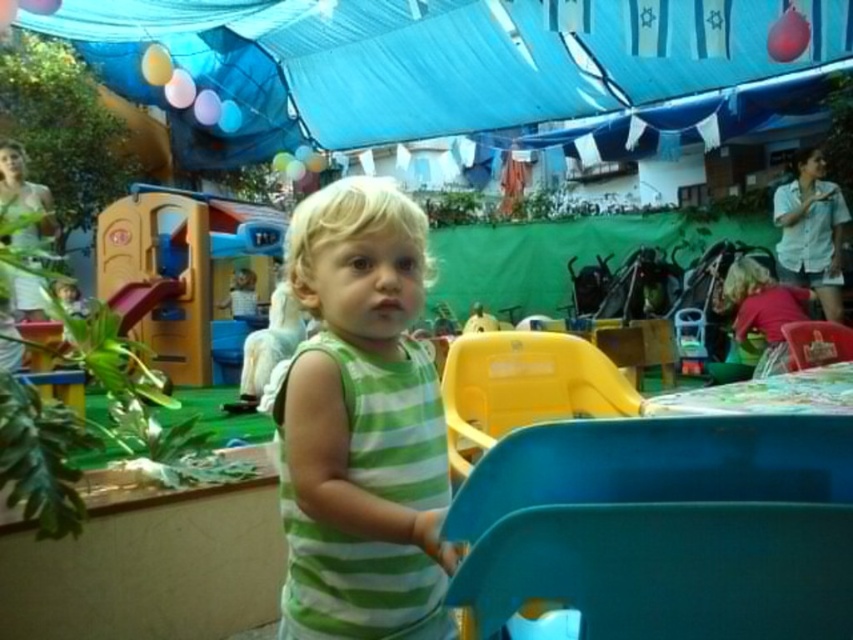
Question: From the image, what is the correct spatial relationship of blue fabric canopy at upper center in relation to green striped tank top at center?

Choices:
 (A) right
 (B) left

Answer: (B)

Question: Which point is closer to the camera?

Choices:
 (A) (444, 4)
 (B) (425, 264)

Answer: (B)

Question: Among these points, which one is farthest from the camera?

Choices:
 (A) (433, 593)
 (B) (833, 58)

Answer: (B)

Question: Is blue fabric canopy at upper center further to the viewer compared to green striped tank top at center?

Choices:
 (A) yes
 (B) no

Answer: (A)

Question: Can you confirm if blue fabric canopy at upper center is wider than green striped tank top at center?

Choices:
 (A) no
 (B) yes

Answer: (B)